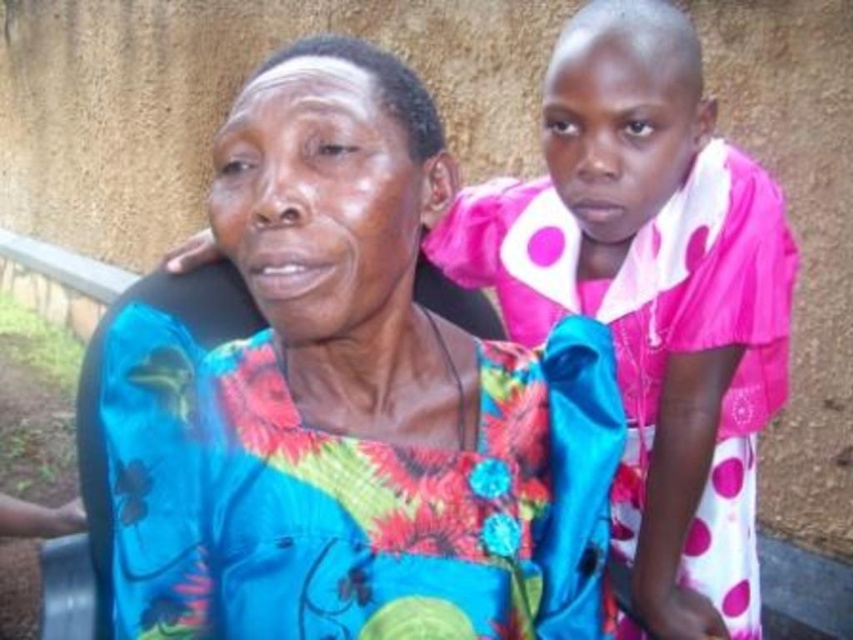
You are a photographer setting up a shoot. You need to ensure that both the floral satin dress at center and the pink polka dot dress at upper right are visible in the frame. Based on their positions, which dress is closer to the bottom of the image?

The floral satin dress at center is positioned under the pink polka dot dress at upper right, so the floral satin dress at center is closer to the bottom of the image.

You are a photographer standing at a certain distance from the floral satin dress at center. You want to ensure that your camera is positioned exactly 30 inches away from the dress to capture the perfect shot. Based on the current distance, should you move closer or farther away?

The current distance between the floral satin dress at center and the camera is 28.95 inches. Since 28.95 inches is less than 30 inches, you should move slightly farther away to reach the desired 30 inches.

You are a photographer trying to capture a photo of both the floral satin dress at center and the pink polka dot dress at upper right. Which dress should you focus on first if you want to ensure both are in frame without moving the camera?

The floral satin dress at center is thinner than the pink polka dot dress at upper right, so you should focus on the pink polka dot dress at upper right first to ensure both are in frame without moving the camera.